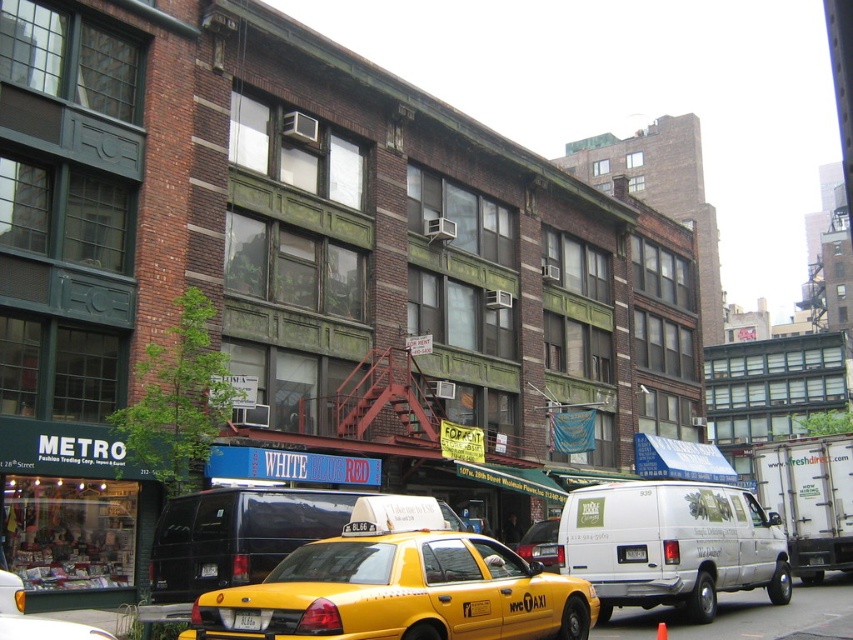
Between point (553, 572) and point (636, 560), which one is positioned in front?

Positioned in front is point (636, 560).

Is yellow rubber taxi cab at center thinner than yellow plastic license plate at center?

Incorrect, yellow rubber taxi cab at center's width is not less than yellow plastic license plate at center's.

Locate an element on the screen. yellow rubber taxi cab at center is located at coordinates (540, 544).

Consider the image. Which is more to the right, yellow matte taxi at center or yellow rubber taxi cab at center?

Positioned to the right is yellow rubber taxi cab at center.

Is yellow matte taxi at center closer to the viewer compared to yellow rubber taxi cab at center?

Yes, yellow matte taxi at center is in front of yellow rubber taxi cab at center.

Is point (379, 518) more distant than point (544, 528)?

No, (379, 518) is in front of (544, 528).

What are the coordinates of `yellow matte taxi at center` in the screenshot? It's located at coord(401,586).

Locate an element on the screen. This screenshot has height=640, width=853. yellow matte taxi at center is located at coordinates (401, 586).

Is yellow matte taxi at center to the right of white matte van at center from the viewer's perspective?

In fact, yellow matte taxi at center is to the left of white matte van at center.

Image resolution: width=853 pixels, height=640 pixels. Describe the element at coordinates (401, 586) in the screenshot. I see `yellow matte taxi at center` at that location.

This screenshot has width=853, height=640. I want to click on yellow matte taxi at center, so click(x=401, y=586).